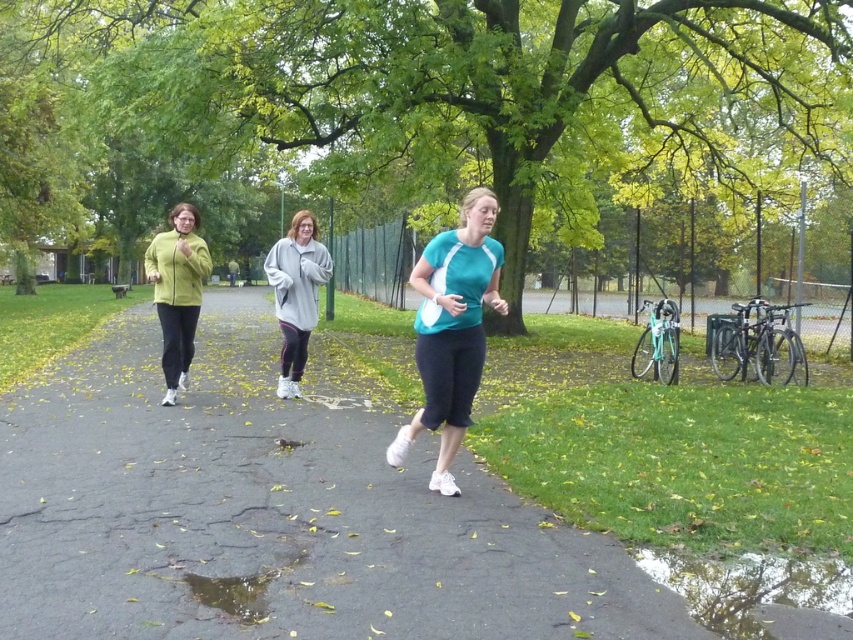
Which is below, teal matte shirt at center or gray fleece sweatshirt at center?

Positioned lower is gray fleece sweatshirt at center.

Does point (444, 356) lie in front of point (277, 275)?

Yes.

You are a GUI agent. You are given a task and a screenshot of the screen. Output one action in this format:
    pyautogui.click(x=<x>, y=<y>)
    Task: Click on the teal matte shirt at center
    
    Given the screenshot: What is the action you would take?
    pyautogui.click(x=451, y=330)

Between teal matte shirt at center and transparent water at lower right, which one appears on the right side from the viewer's perspective?

transparent water at lower right is more to the right.

Between teal matte shirt at center and transparent water at lower right, which one is positioned higher?

Positioned higher is teal matte shirt at center.

Between point (450, 481) and point (815, 570), which one is positioned in front?

Point (815, 570) is in front.

At what (x,y) coordinates should I click in order to perform the action: click on teal matte shirt at center. Please return your answer as a coordinate pair (x, y). This screenshot has width=853, height=640. Looking at the image, I should click on (451, 330).

Which of these two, transparent water at lower right or matte green jacket at left, stands taller?

With more height is matte green jacket at left.

Which is more to the left, transparent water at lower right or matte green jacket at left?

Positioned to the left is matte green jacket at left.

Does point (795, 600) come farther from viewer compared to point (186, 230)?

That is False.

The image size is (853, 640). I want to click on transparent water at lower right, so click(749, 586).